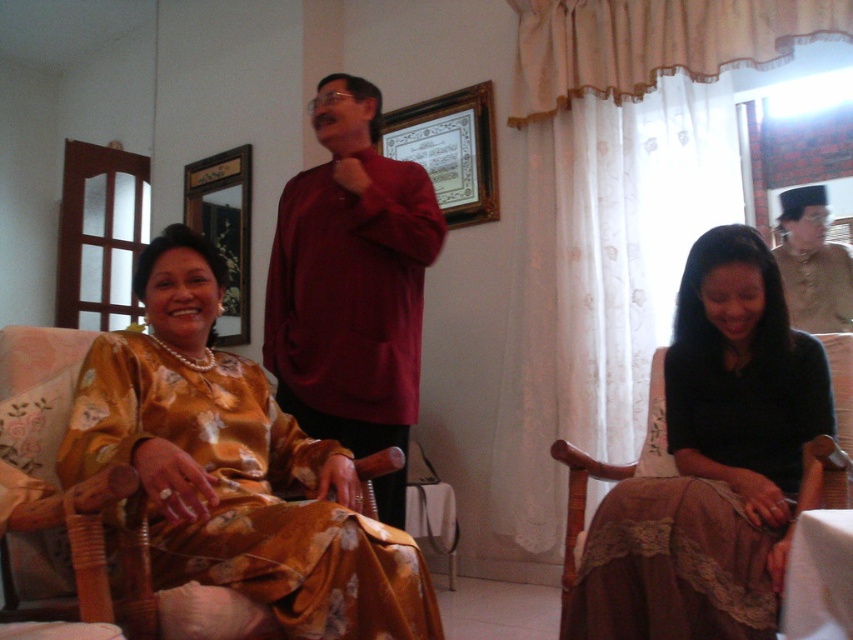
You are a photographer trying to capture a photo of the black lace skirt at lower right and the wooden framed picture at upper center. Which object will appear larger in the photo?

The black lace skirt at lower right is much taller than the wooden framed picture at upper center, so it will appear larger in the photo.

You are a photographer setting up a shoot in this room. You need to position a light source between the black lace skirt at lower right and the matte brown robe at right. Based on their positions, where should you place the light source?

The black lace skirt at lower right is to the left of the matte brown robe at right, so the light source should be placed between them, to the right of the black lace skirt at lower right and to the left of the matte brown robe at right.